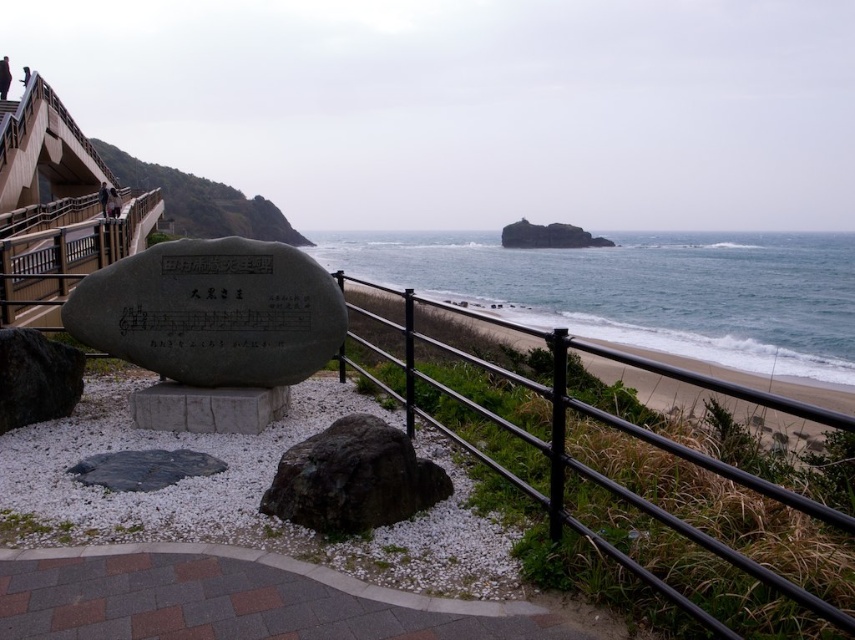
You are a geologist examining the coastal area. You have a measuring tape and need to determine if the dark brown rock at center can fit through a gap between two other rocks that is exactly the width of the dark gray rock at lower left. Can it fit?

The dark brown rock at center might be wider than dark gray rock at lower left, so it may not fit through the gap.

You are a visitor standing on the paved pathway and want to touch both the black metal fence at center and the dark brown rock at center. Which object should you reach for first if you want to touch the closer one?

The dark brown rock at center is closer to you than the black metal fence at center, so you should reach for the dark brown rock at center first.